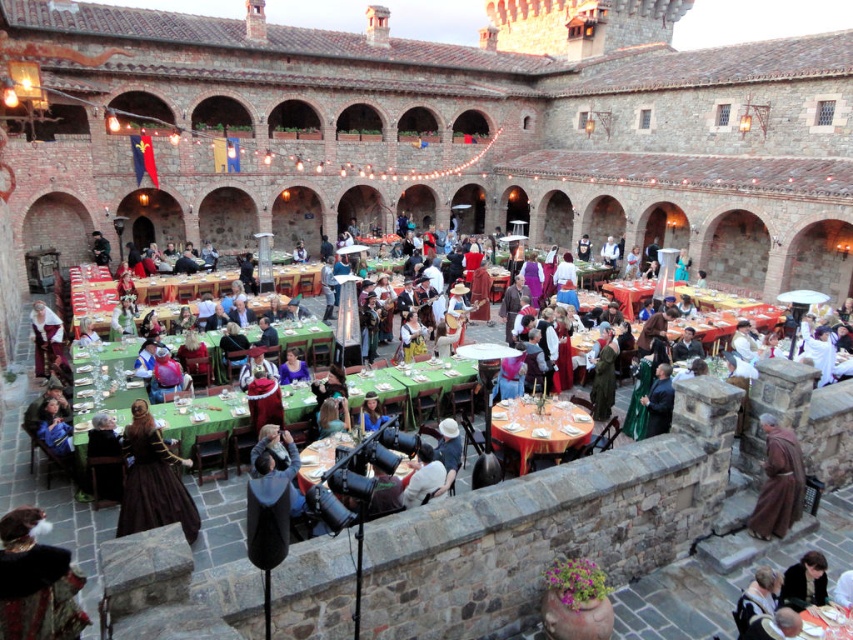
Between point (415, 420) and point (427, 458), which one is positioned behind?

Positioned behind is point (415, 420).

In the scene shown: Does green fabric table at center have a lesser height compared to brown leather jacket at lower center?

Yes, green fabric table at center is shorter than brown leather jacket at lower center.

Does point (412, 390) come in front of point (434, 476)?

No.

Find the location of `green fabric table at center`. green fabric table at center is located at coordinates (432, 380).

Is brown woolen robe at lower right to the left of green velvet robe at center from the viewer's perspective?

No, brown woolen robe at lower right is not to the left of green velvet robe at center.

Does point (767, 467) come behind point (666, 365)?

No, (767, 467) is closer to viewer.

Locate an element on the screen. brown woolen robe at lower right is located at coordinates pyautogui.click(x=778, y=483).

Is point (521, 448) more distant than point (395, 365)?

No, (521, 448) is closer to viewer.

Which is below, orange tablecloth at center or green fabric table at center?

orange tablecloth at center is lower down.

Between point (573, 444) and point (451, 385), which one is positioned in front?

Positioned in front is point (573, 444).

This screenshot has height=640, width=853. What are the coordinates of `orange tablecloth at center` in the screenshot? It's located at tap(538, 426).